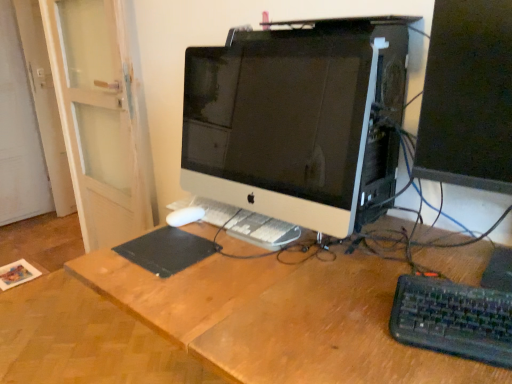
This screenshot has width=512, height=384. In order to click on vacant region in front of black matte mousepad at center in this screenshot , I will do `click(166, 288)`.